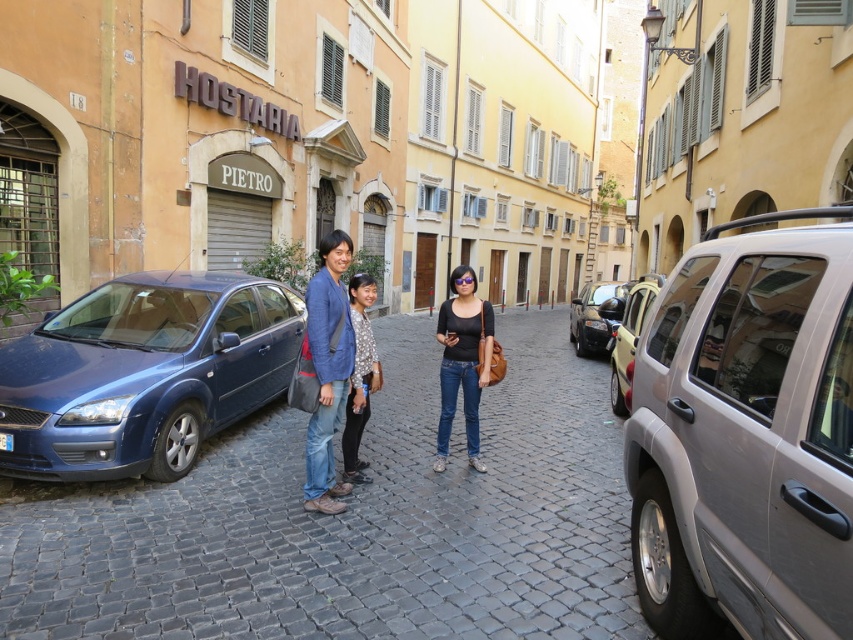
Question: Does metallic blue car at left come behind denim jacket at center?

Choices:
 (A) yes
 (B) no

Answer: (B)

Question: Among these objects, which one is nearest to the camera?

Choices:
 (A) metallic silver car at center right
 (B) metallic blue car at left
 (C) black matte shirt at center
 (D) silver metallic minivan at right

Answer: (D)

Question: Which of the following is the closest to the observer?

Choices:
 (A) shiny black car at center
 (B) silver metallic minivan at right

Answer: (B)

Question: Is metallic blue car at left positioned behind patterned fabric blouse at center?

Choices:
 (A) no
 (B) yes

Answer: (A)

Question: Estimate the real-world distances between objects in this image. Which object is farther from the metallic blue sedan at left?

Choices:
 (A) metallic blue car at left
 (B) patterned fabric blouse at center
 (C) shiny black car at center

Answer: (C)

Question: Does patterned fabric blouse at center come behind metallic silver car at center right?

Choices:
 (A) no
 (B) yes

Answer: (A)